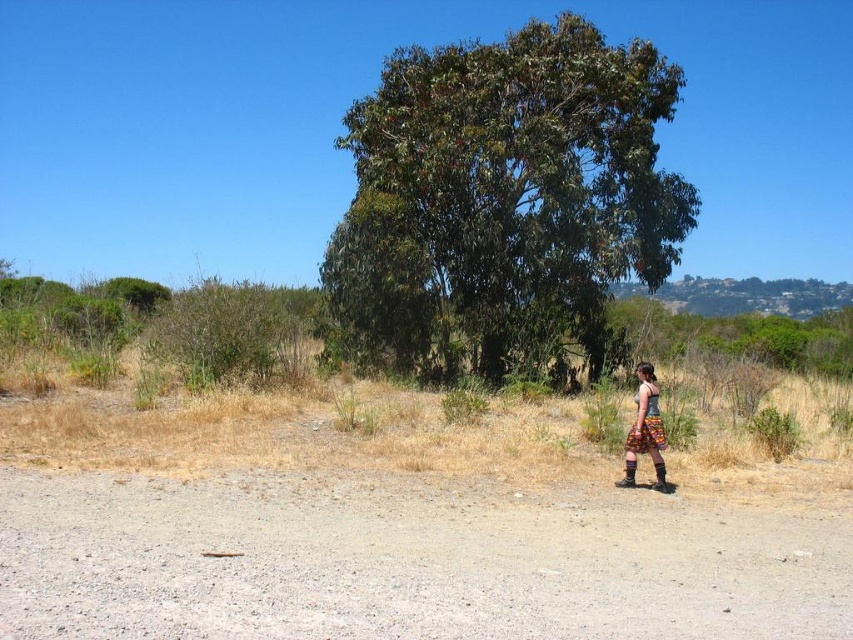
You are standing on the gravel path and want to place a small potted plant in front of the green leafy tree at center so that it is visible from the printed fabric skirt at lower right. Is this possible?

The green leafy tree at center is positioned over the printed fabric skirt at lower right, so placing the potted plant in front of the tree would still allow it to be seen from the skirt location as long as it is not directly blocked by the tree.

You are standing at the edge of the gravel path in the rural scene. You see the green leafy tree at center and the printed fabric skirt at lower right. Which object is farther away from you?

The distance between the green leafy tree at center and the printed fabric skirt at lower right is 48.04 feet. Since you are on the gravel path, the green leafy tree at center is farther away than the printed fabric skirt at lower right.